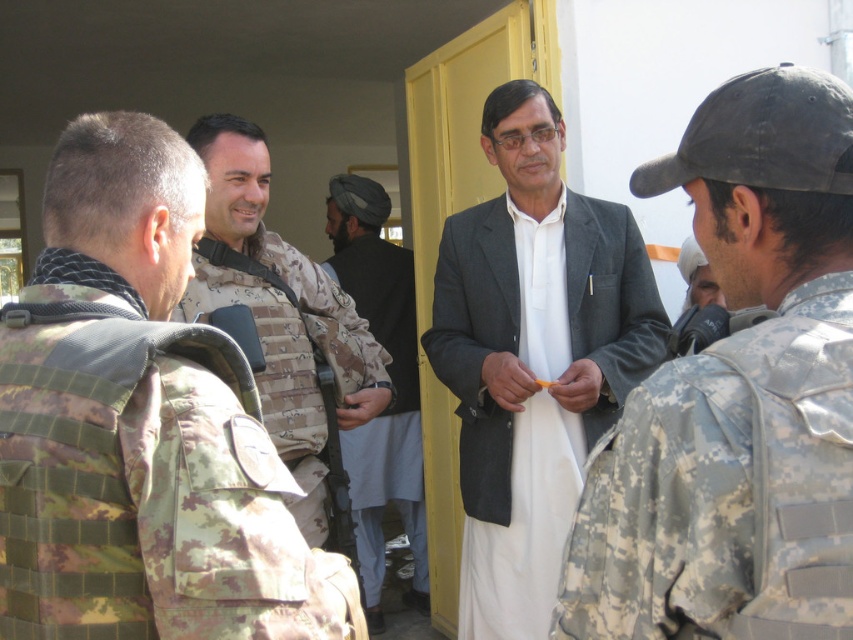
What is the color of the shirt at the point labeled as point [534,381]?

The point [534,381] is on white cotton shirt at center, so the color is white.

You are a photographer trying to capture a clear photo of both the camouflage fabric vest at left and the camouflage fabric vest at center. Since the vests are positioned close to each other, will you need to adjust your camera angle to ensure both are in focus?

The camouflage fabric vest at left is positioned under the camouflage fabric vest at center, so adjusting the camera angle slightly downward might help capture both vests clearly without obstruction.

You are standing in front of the image and want to touch the camouflage fabric uniform at center and the white cotton shirt at center. Which one would you need to reach out further to touch?

The white cotton shirt at center is further away from you than the camouflage fabric uniform at center, so you would need to reach out further to touch the white cotton shirt at center.